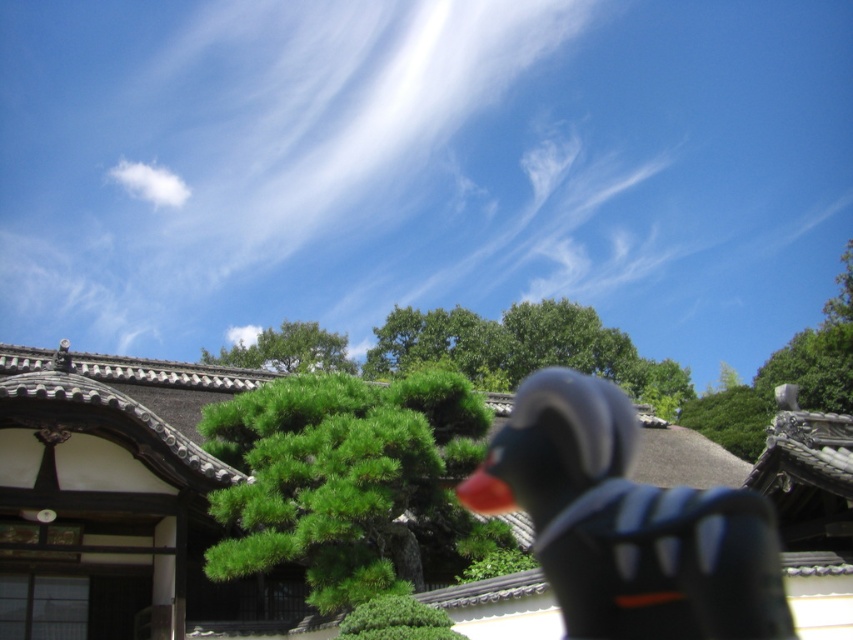
You are a photographer trying to capture the black matte duck at center and the green leafy tree at center in the same frame. Based on their positions, which object should you focus on first if you want both to be in focus?

The black matte duck at center is located below the green leafy tree at center. To get both in focus, you should focus on the green leafy tree at center first since it is farther away from the camera, allowing the depth of field to cover the closer duck.

You are standing at the point marked as point (346, 480) in the image. Looking around, you see a green matte tree at center. What is directly under your feet at this point?

The green matte tree at center is located at point (346, 480), so that is what is directly under your feet at this point.

You are an artist trying to sketch this scene. You want to place the black matte duck at center and the white fluffy cloud at upper left accurately. Based on the scene description, which object should be drawn to the right side of the other?

The black matte duck at center is positioned on the right side of white fluffy cloud at upper left, so the duck should be drawn to the right of the cloud.